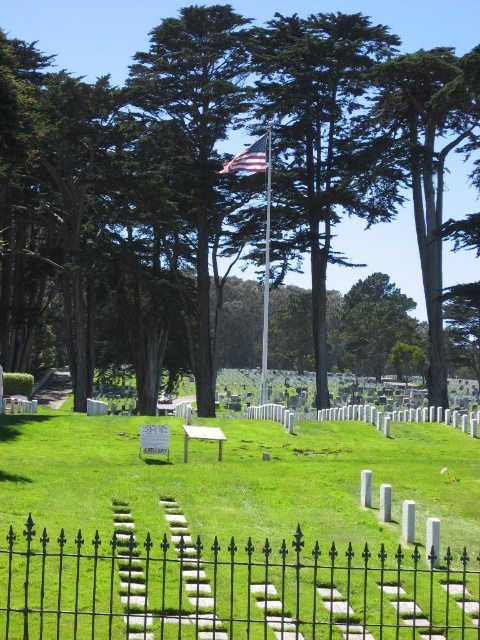
Question: Can you confirm if black wrought iron fence at lower center is positioned above silver metallic flag pole at center?

Choices:
 (A) yes
 (B) no

Answer: (B)

Question: Among these points, which one is farthest from the camera?

Choices:
 (A) (256, 145)
 (B) (349, 561)
 (C) (309, 99)

Answer: (C)

Question: Does silver metallic flag pole at center have a larger size compared to american flag at center?

Choices:
 (A) yes
 (B) no

Answer: (A)

Question: Which point appears farthest from the camera in this image?

Choices:
 (A) (336, 13)
 (B) (291, 595)

Answer: (A)

Question: Estimate the real-world distances between objects in this image. Which object is farther from the black wrought iron fence at lower center?

Choices:
 (A) american flag at center
 (B) silver metallic flag pole at center
 (C) green leafy tree at center

Answer: (C)

Question: Can you confirm if green leafy tree at center is positioned below silver metallic flag pole at center?

Choices:
 (A) no
 (B) yes

Answer: (A)